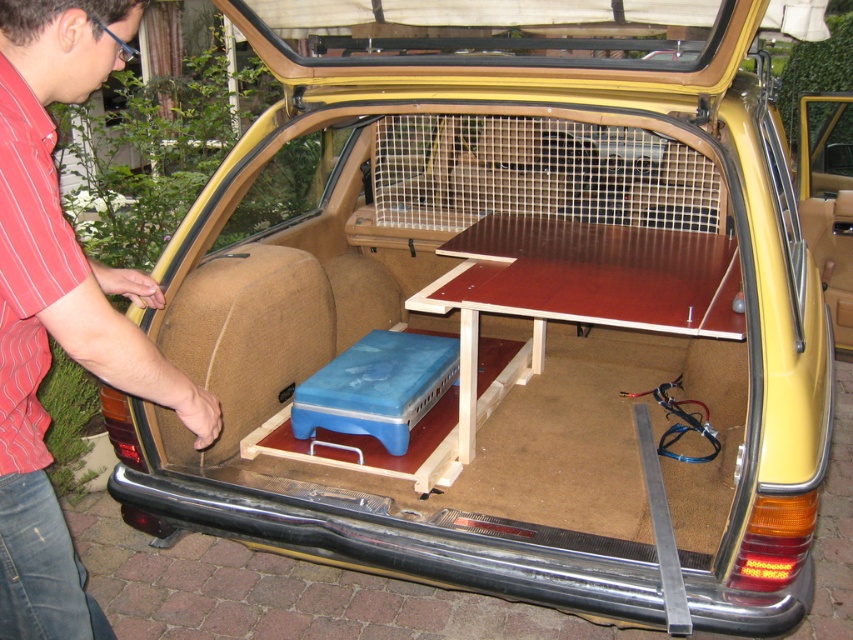
Question: Is red striped shirt at left further to camera compared to brown wooden picnic table at center?

Choices:
 (A) no
 (B) yes

Answer: (A)

Question: Which point appears closest to the camera in this image?

Choices:
 (A) (24, 234)
 (B) (468, 228)

Answer: (A)

Question: Can you confirm if red striped shirt at left is positioned above brown wooden picnic table at center?

Choices:
 (A) yes
 (B) no

Answer: (B)

Question: Does red striped shirt at left appear over brown wooden picnic table at center?

Choices:
 (A) yes
 (B) no

Answer: (B)